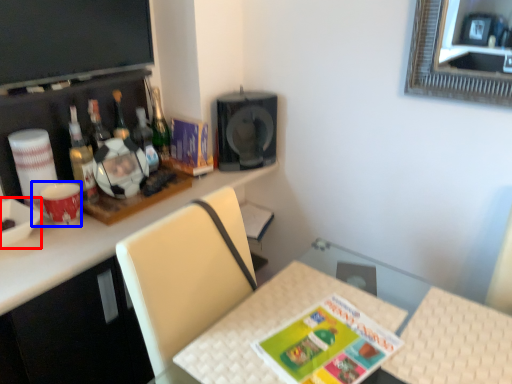
Question: Among these objects, which one is nearest to the camera, bowl (highlighted by a red box) or coffee cup (highlighted by a blue box)?

Choices:
 (A) bowl
 (B) coffee cup

Answer: (A)